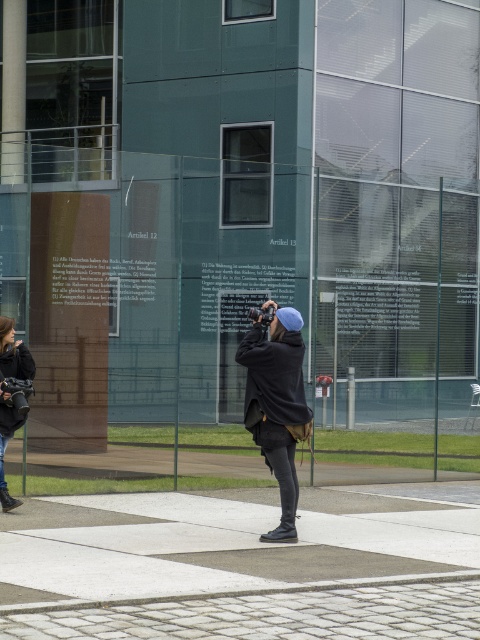
Question: Can you confirm if matte black jacket at center is positioned below denim jacket at lower left?

Choices:
 (A) no
 (B) yes

Answer: (A)

Question: Does matte black jacket at center appear on the right side of denim jacket at lower left?

Choices:
 (A) yes
 (B) no

Answer: (A)

Question: Which point appears closest to the camera in this image?

Choices:
 (A) (29, 376)
 (B) (276, 364)

Answer: (B)

Question: Can you confirm if matte black jacket at center is positioned to the left of denim jacket at lower left?

Choices:
 (A) no
 (B) yes

Answer: (A)

Question: Which of the following is the farthest from the observer?

Choices:
 (A) (22, 353)
 (B) (276, 474)

Answer: (A)

Question: Which of the following is the closest to the observer?

Choices:
 (A) (252, 362)
 (B) (4, 332)

Answer: (A)